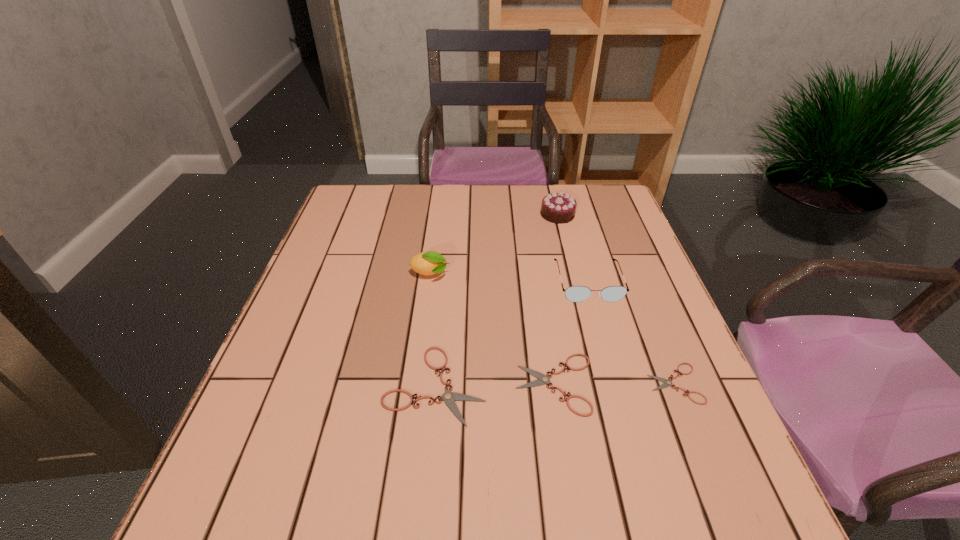
Find the location of a particular element. Image resolution: width=960 pixels, height=540 pixels. free space located on the back of the shortest object is located at coordinates (623, 254).

Identify the location of vacant region located on the front of the farthest object. This screenshot has width=960, height=540. (566, 251).

At what (x,y) coordinates should I click in order to perform the action: click on vacant space located with leaves positioned above the lemon. Please return your answer as a coordinate pair (x, y). Image resolution: width=960 pixels, height=540 pixels. Looking at the image, I should click on (473, 274).

Where is `free location located 0.070m on the lenses of the third tallest object`? The image size is (960, 540). free location located 0.070m on the lenses of the third tallest object is located at coordinates (600, 325).

The image size is (960, 540). In order to click on object located at the far edge in this screenshot , I will do `click(559, 208)`.

Find the location of `object that is positioned at the near edge`. object that is positioned at the near edge is located at coordinates (449, 397).

I want to click on shears at the right edge, so click(667, 383).

Image resolution: width=960 pixels, height=540 pixels. Identify the location of chocolate cake present at the right edge. (559, 208).

This screenshot has width=960, height=540. Identify the location of spectacles at the right edge. (574, 293).

The image size is (960, 540). In order to click on object that is at the far right corner in this screenshot , I will do `click(559, 208)`.